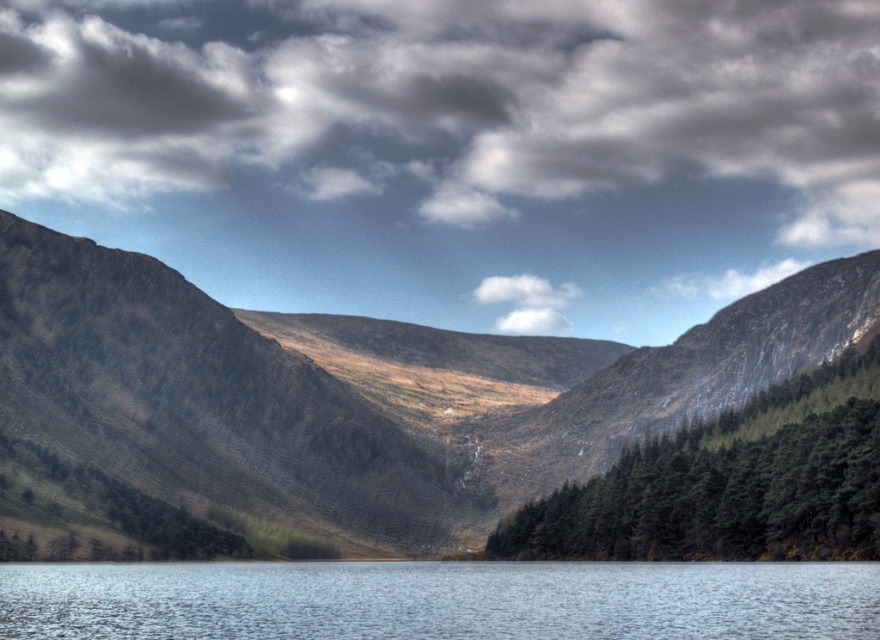
Question: Among these points, which one is nearest to the camera?

Choices:
 (A) (569, 602)
 (B) (32, 262)
 (C) (704, 472)

Answer: (A)

Question: Is rugged stone mountain at center to the right of transparent water at center from the viewer's perspective?

Choices:
 (A) no
 (B) yes

Answer: (B)

Question: From the image, what is the correct spatial relationship of transparent water at center in relation to green matte trees at center?

Choices:
 (A) below
 (B) above

Answer: (A)

Question: Which point appears closest to the camera in this image?

Choices:
 (A) (517, 426)
 (B) (801, 428)

Answer: (B)

Question: Among these points, which one is nearest to the camera?

Choices:
 (A) (742, 428)
 (B) (412, 433)

Answer: (A)

Question: Does rugged stone mountain at center have a greater width compared to transparent water at center?

Choices:
 (A) no
 (B) yes

Answer: (B)